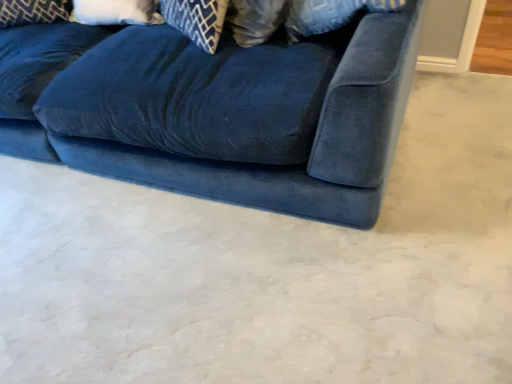
Question: Can velvet blue couch at center be found inside velvet blue pillow at upper left, arranged as the first pillow when viewed from the left?

Choices:
 (A) no
 (B) yes

Answer: (A)

Question: Considering the relative sizes of velvet blue pillow at upper left, arranged as the first pillow when viewed from the left, and velvet blue couch at center in the image provided, is velvet blue pillow at upper left, arranged as the first pillow when viewed from the left, shorter than velvet blue couch at center?

Choices:
 (A) no
 (B) yes

Answer: (B)

Question: From a real-world perspective, is velvet blue pillow at upper left, arranged as the first pillow when viewed from the left, under velvet blue couch at center?

Choices:
 (A) no
 (B) yes

Answer: (A)

Question: Is the depth of velvet blue pillow at upper left, arranged as the first pillow when viewed from the left, less than that of velvet blue couch at center?

Choices:
 (A) no
 (B) yes

Answer: (A)

Question: Considering the relative sizes of velvet blue pillow at upper left, which is the second pillow from right to left, and velvet blue couch at center in the image provided, is velvet blue pillow at upper left, which is the second pillow from right to left, wider than velvet blue couch at center?

Choices:
 (A) no
 (B) yes

Answer: (A)

Question: Is velvet blue pillow at upper left, arranged as the first pillow when viewed from the left, taller or shorter than white soft pillow at upper left, the first pillow when ordered from right to left?

Choices:
 (A) short
 (B) tall

Answer: (B)

Question: From a real-world perspective, relative to white soft pillow at upper left, acting as the 2th pillow starting from the left, is velvet blue pillow at upper left, which is the second pillow from right to left, vertically above or below?

Choices:
 (A) above
 (B) below

Answer: (A)

Question: Considering the positions of velvet blue pillow at upper left, arranged as the first pillow when viewed from the left, and white soft pillow at upper left, the first pillow when ordered from right to left, in the image, is velvet blue pillow at upper left, arranged as the first pillow when viewed from the left, wider or thinner than white soft pillow at upper left, the first pillow when ordered from right to left,?

Choices:
 (A) thin
 (B) wide

Answer: (B)

Question: Is velvet blue pillow at upper left, which is the second pillow from right to left, spatially inside white soft pillow at upper left, the first pillow when ordered from right to left, or outside of it?

Choices:
 (A) outside
 (B) inside

Answer: (A)

Question: From a real-world perspective, relative to velvet blue couch at center, is velvet blue pillow at upper left, arranged as the first pillow when viewed from the left, vertically above or below?

Choices:
 (A) below
 (B) above

Answer: (B)

Question: In terms of width, does velvet blue pillow at upper left, which is the second pillow from right to left, look wider or thinner when compared to velvet blue couch at center?

Choices:
 (A) thin
 (B) wide

Answer: (A)

Question: In terms of height, does velvet blue pillow at upper left, arranged as the first pillow when viewed from the left, look taller or shorter compared to velvet blue couch at center?

Choices:
 (A) tall
 (B) short

Answer: (B)

Question: Is velvet blue pillow at upper left, which is the second pillow from right to left, in front of or behind velvet blue couch at center in the image?

Choices:
 (A) behind
 (B) front

Answer: (A)

Question: From a real-world perspective, is velvet blue couch at center physically located above or below velvet blue pillow at upper left, arranged as the first pillow when viewed from the left?

Choices:
 (A) below
 (B) above

Answer: (A)

Question: Looking at their shapes, would you say velvet blue couch at center is wider or thinner than velvet blue pillow at upper left, which is the second pillow from right to left?

Choices:
 (A) wide
 (B) thin

Answer: (A)